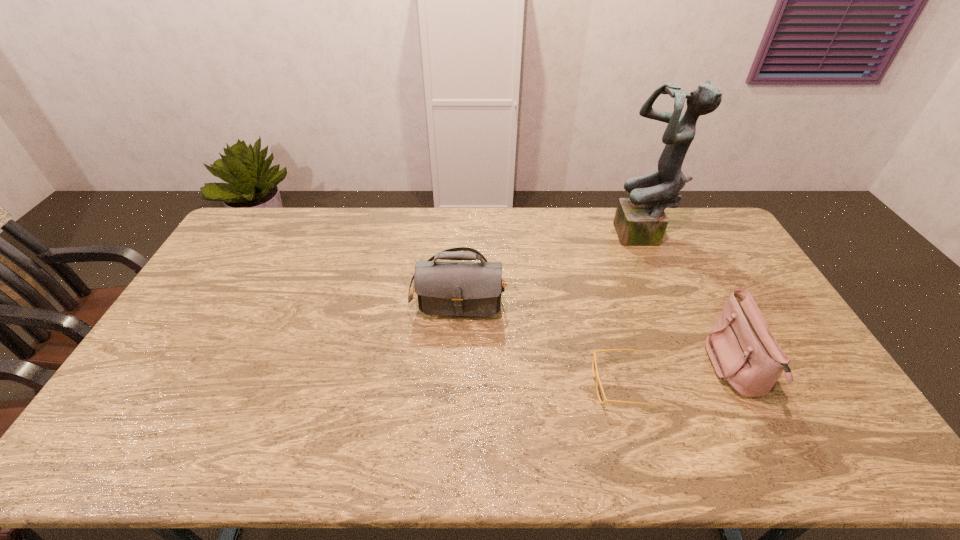
Where is `vacant space situated on the left of the second tallest object`? vacant space situated on the left of the second tallest object is located at coordinates (396, 285).

Find the location of a particular element. This screenshot has height=540, width=960. free region located 0.280m on the front pocket of the second shortest object is located at coordinates (610, 369).

The height and width of the screenshot is (540, 960). Identify the location of vacant region located on the front pocket of the second shortest object. (646, 369).

Where is `vacant position located on the front pocket of the second shortest object`? The width and height of the screenshot is (960, 540). vacant position located on the front pocket of the second shortest object is located at coordinates (667, 369).

This screenshot has width=960, height=540. I want to click on vacant position located 0.300m in front of the lenses of the second object from left to right, so click(482, 384).

The image size is (960, 540). I want to click on free space located in front of the lenses of the second object from left to right, so click(x=549, y=384).

This screenshot has height=540, width=960. I want to click on vacant space situated 0.240m in front of the lenses of the second object from left to right, so click(505, 384).

Where is `object that is positioned at the far edge`? The height and width of the screenshot is (540, 960). object that is positioned at the far edge is located at coordinates (640, 220).

At what (x,y) coordinates should I click in order to perform the action: click on object located at the right edge. Please return your answer as a coordinate pair (x, y). Looking at the image, I should click on (744, 353).

Identify the location of vacant space at the far edge of the desktop. (471, 242).